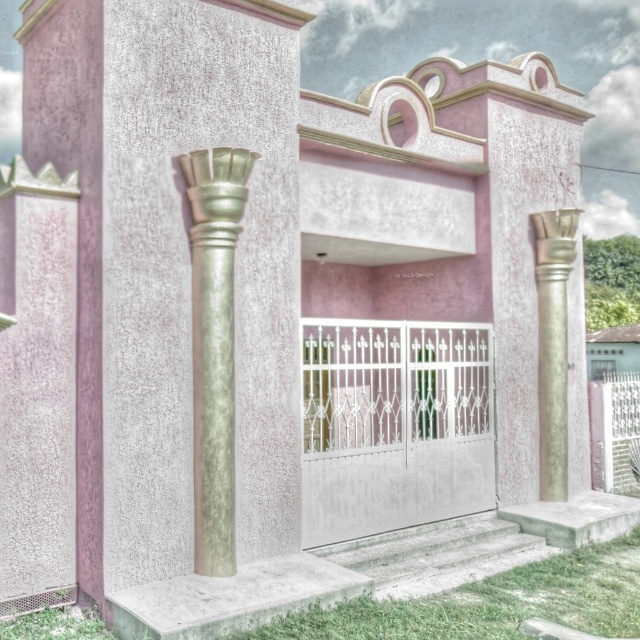
Question: Among these points, which one is farthest from the camera?

Choices:
 (A) (540, 426)
 (B) (202, 465)

Answer: (A)

Question: Observing the image, what is the correct spatial positioning of green marble column at left in reference to gold textured column at right?

Choices:
 (A) above
 (B) below

Answer: (A)

Question: Among these points, which one is nearest to the camera?

Choices:
 (A) (196, 257)
 (B) (544, 433)

Answer: (A)

Question: Can you confirm if green marble column at left is thinner than gold textured column at right?

Choices:
 (A) no
 (B) yes

Answer: (A)

Question: Can you confirm if green marble column at left is bigger than gold textured column at right?

Choices:
 (A) no
 (B) yes

Answer: (A)

Question: Which of the following is the closest to the observer?

Choices:
 (A) (208, 212)
 (B) (547, 493)

Answer: (A)